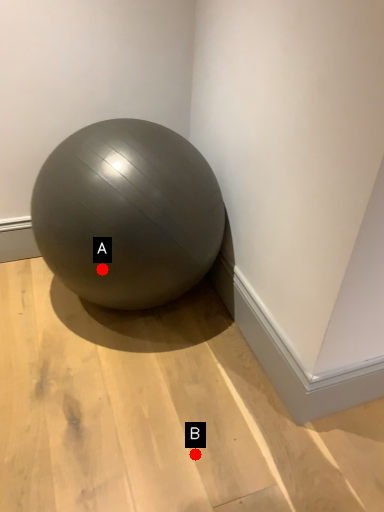
Question: Two points are circled on the image, labeled by A and B beside each circle. Which point is closer to the camera?

Choices:
 (A) A is closer
 (B) B is closer

Answer: (B)